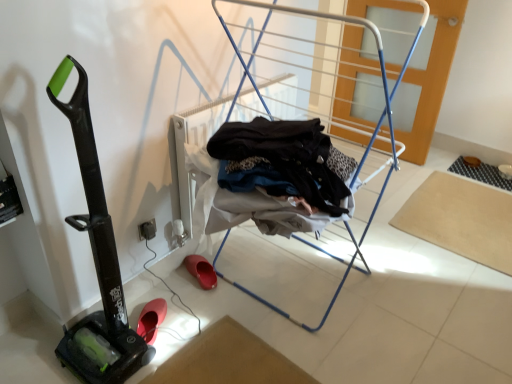
Identify the location of vacant area that lies between black rubber vacuum at left and rubber/matte clog at lower left, the 1th footwear from the back. This screenshot has width=512, height=384. (173, 301).